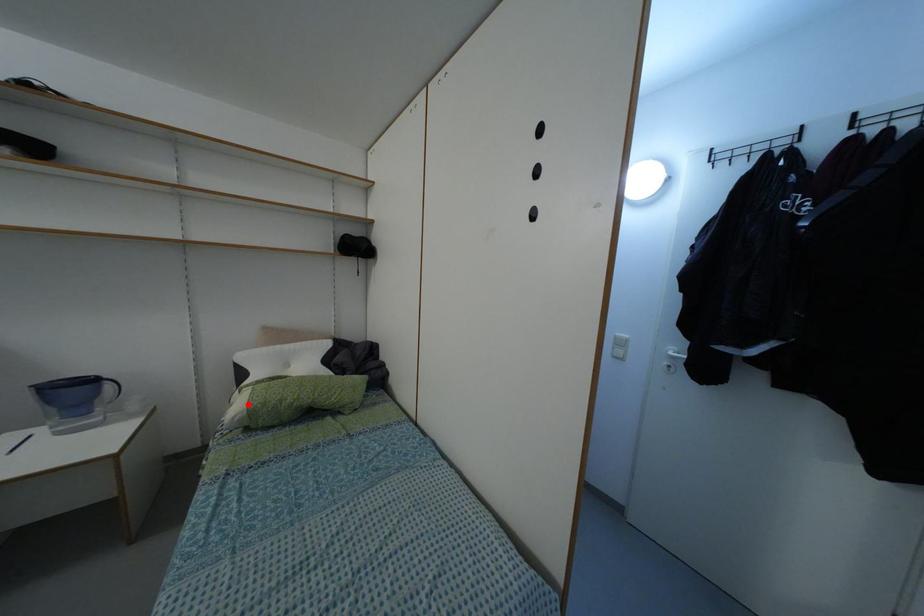
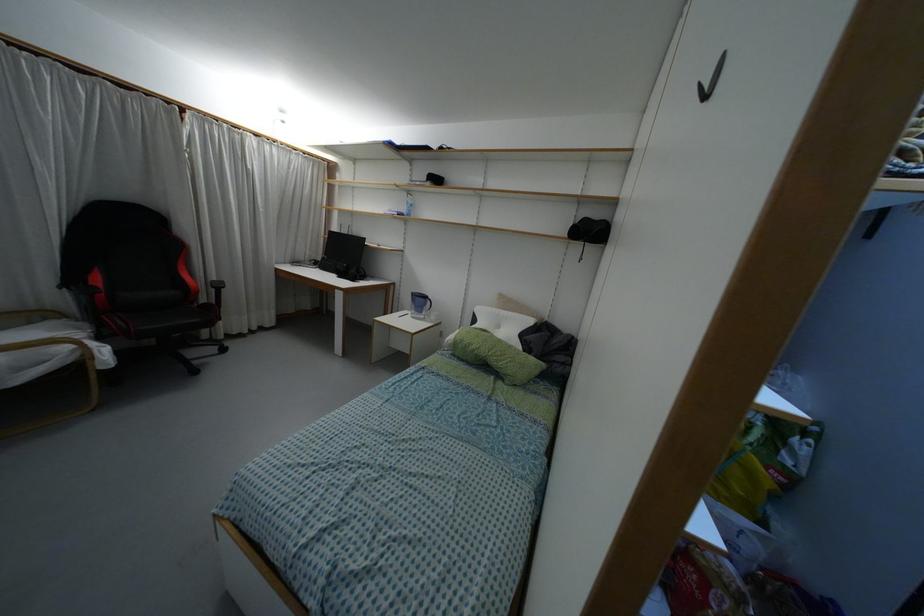
Where in the second image is the point corresponding to the highlighted location from the first image?

(455, 337)